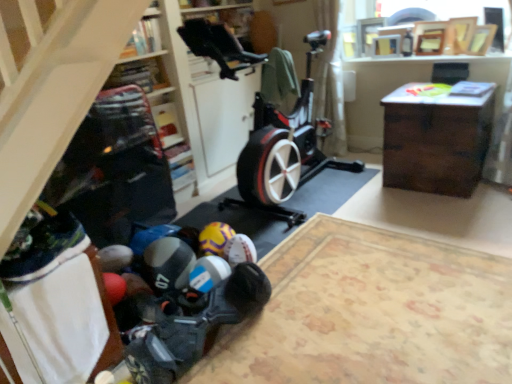
In order to click on vacant space to the right of rubberized plastic toy at lower center, the first toy when ordered from front to back in this screenshot , I will do `click(302, 327)`.